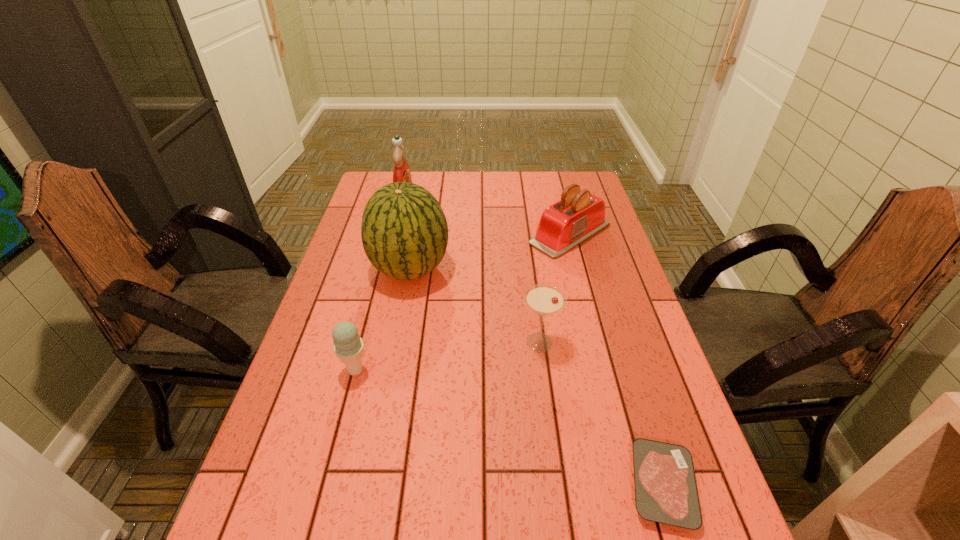
Where is `free space located 0.160m on the right of the fourth farthest object`? free space located 0.160m on the right of the fourth farthest object is located at coordinates (622, 342).

You are a GUI agent. You are given a task and a screenshot of the screen. Output one action in this format:
    pyautogui.click(x=<x>, y=<y>)
    Task: Click on the vacant space located on the right of the ice cream
    This screenshot has height=540, width=960.
    Given the screenshot: What is the action you would take?
    pyautogui.click(x=428, y=370)

Where is `free space located on the left of the shortest object`? free space located on the left of the shortest object is located at coordinates (456, 485).

The image size is (960, 540). Find the location of `object at the far edge`. object at the far edge is located at coordinates (401, 173).

Identify the location of watermelon present at the left edge. (404, 231).

Identify the location of detergent located at the left edge. The height and width of the screenshot is (540, 960). (401, 173).

Locate an element on the screen. This screenshot has width=960, height=540. ice cream that is at the left edge is located at coordinates (348, 346).

What are the coordinates of `toaster positioned at the right edge` in the screenshot? It's located at (579, 215).

You are a GUI agent. You are given a task and a screenshot of the screen. Output one action in this format:
    pyautogui.click(x=<x>, y=<y>)
    Task: Click on the steak that is at the right edge
    
    Given the screenshot: What is the action you would take?
    pyautogui.click(x=666, y=492)

Locate an element on the screen. object located at the far left corner is located at coordinates (401, 173).